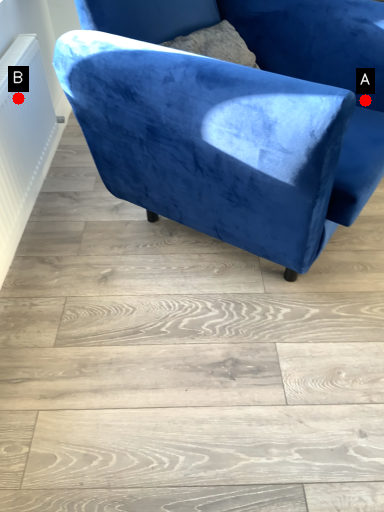
Question: Two points are circled on the image, labeled by A and B beside each circle. Which point is closer to the camera?

Choices:
 (A) A is closer
 (B) B is closer

Answer: (B)